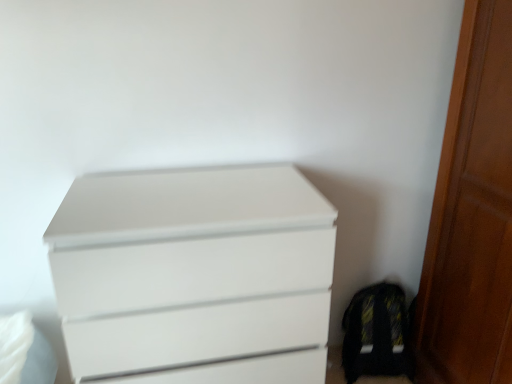
What do you see at coordinates (194, 276) in the screenshot?
I see `white matte chest of drawers at lower left` at bounding box center [194, 276].

Find the location of a particular element. white matte chest of drawers at lower left is located at coordinates (194, 276).

You are a GUI agent. You are given a task and a screenshot of the screen. Output one action in this format:
    pyautogui.click(x=<x>, y=<y>)
    Task: Click on the white matte chest of drawers at lower left
    
    Given the screenshot: What is the action you would take?
    pyautogui.click(x=194, y=276)